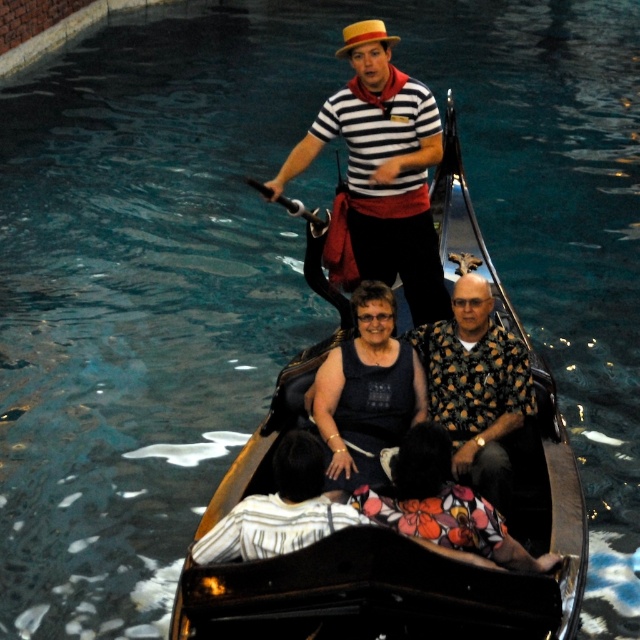
Question: Which point appears closest to the camera in this image?

Choices:
 (A) (289, 454)
 (B) (492, 355)

Answer: (A)

Question: Which object is closer to the camera taking this photo?

Choices:
 (A) black polished wood canoe at center
 (B) floral print shirt at center

Answer: (A)

Question: Does floral print shirt at center come in front of floral fabric dress at center?

Choices:
 (A) yes
 (B) no

Answer: (B)

Question: Is black polished wood canoe at center wider than white striped shirt at center?

Choices:
 (A) no
 (B) yes

Answer: (B)

Question: Where is dark blue fabric tank top at center located in relation to white striped shirt at center in the image?

Choices:
 (A) below
 (B) above

Answer: (B)

Question: Which point is closer to the camera?

Choices:
 (A) (435, 348)
 (B) (344, 323)

Answer: (A)